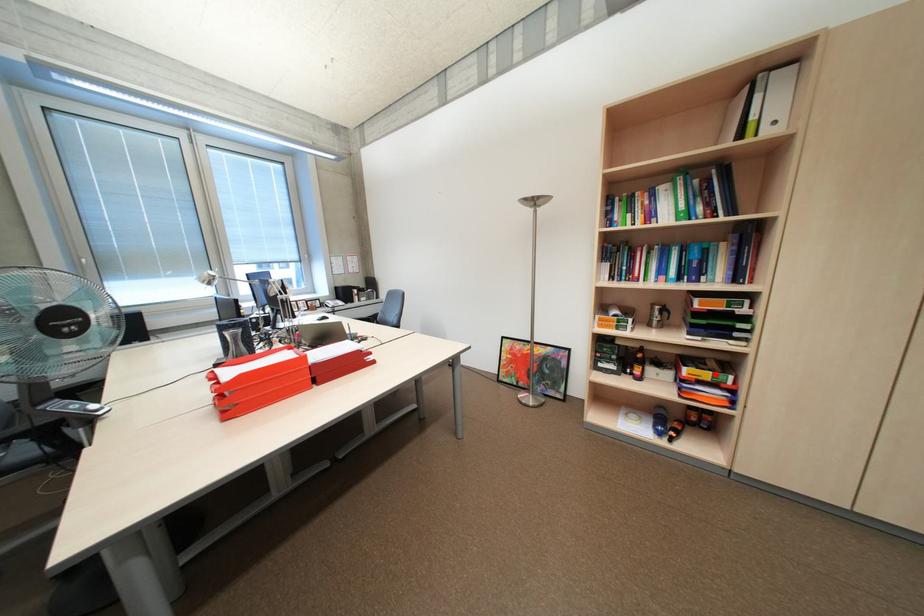
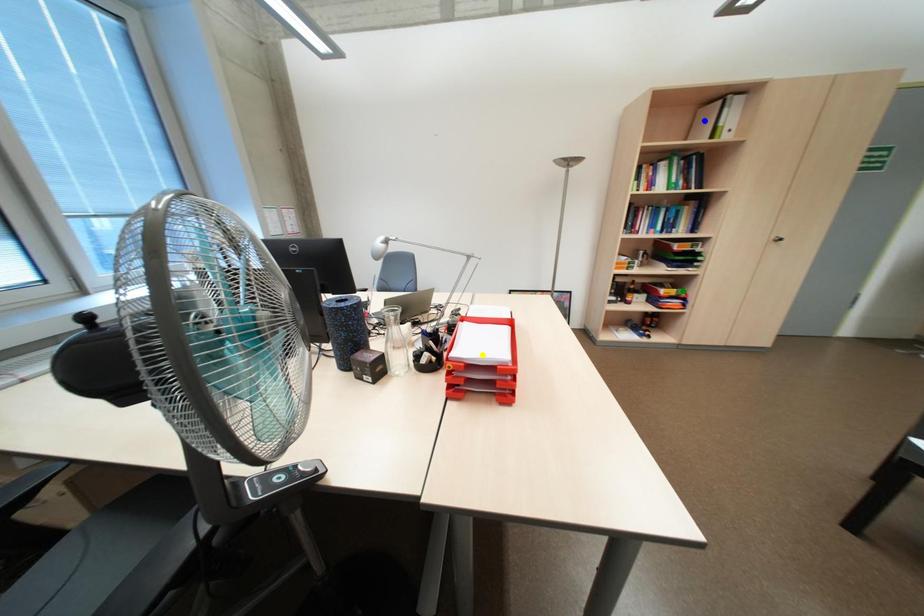
Question: I am providing you with two images of the same scene from different viewpoints. A red point is marked on the first image. You are given multiple points on the second image. Which spot in image 2 lines up with the point in image 1?

Choices:
 (A) green point
 (B) yellow point
 (C) blue point

Answer: (A)